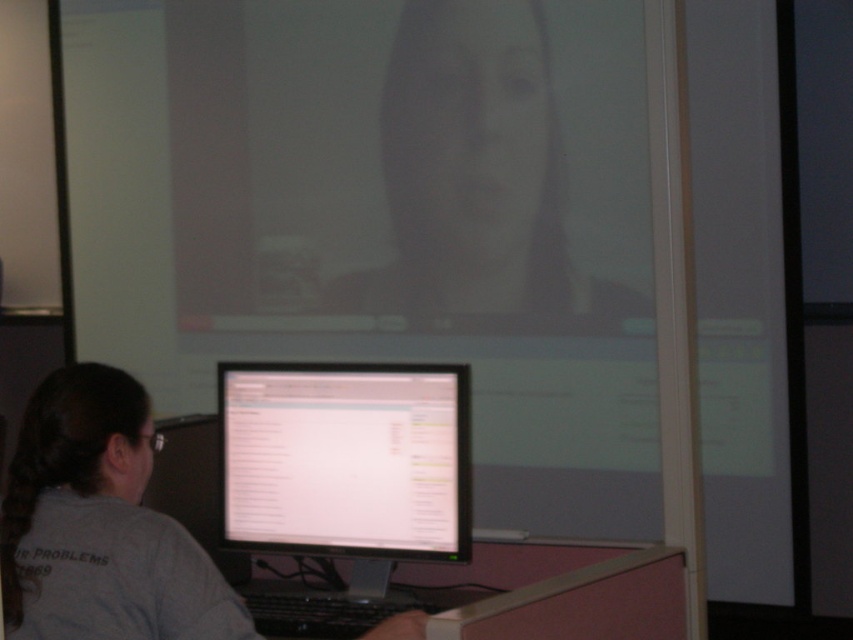
Question: Does smooth skin face at upper center come behind white glossy monitor at center?

Choices:
 (A) yes
 (B) no

Answer: (A)

Question: Which object appears closest to the camera in this image?

Choices:
 (A) smooth skin face at upper center
 (B) matte white screen at upper center

Answer: (B)

Question: Which of the following is the farthest from the observer?

Choices:
 (A) white glossy monitor at center
 (B) matte white screen at upper center
 (C) smooth skin face at upper center

Answer: (C)

Question: Is the position of matte white screen at upper center less distant than that of smooth skin face at upper center?

Choices:
 (A) no
 (B) yes

Answer: (B)

Question: Which object is farther from the camera taking this photo?

Choices:
 (A) matte white screen at upper center
 (B) smooth skin face at upper center
 (C) white glossy monitor at center

Answer: (B)

Question: Is matte white screen at upper center closer to the viewer compared to white glossy monitor at center?

Choices:
 (A) yes
 (B) no

Answer: (B)